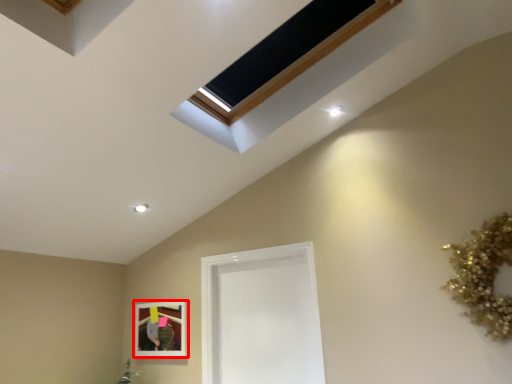
Question: From the image's perspective, considering the relative positions of picture frame (annotated by the red box) and glass door in the image provided, where is picture frame (annotated by the red box) located with respect to the staircase?

Choices:
 (A) below
 (B) above

Answer: (A)